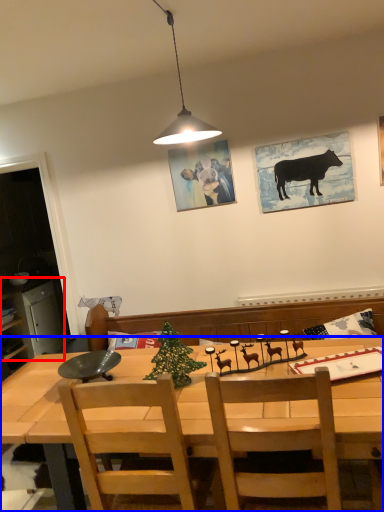
Question: Which of the following is the farthest to the observer, cabinetry (highlighted by a red box) or desk (highlighted by a blue box)?

Choices:
 (A) cabinetry
 (B) desk

Answer: (A)